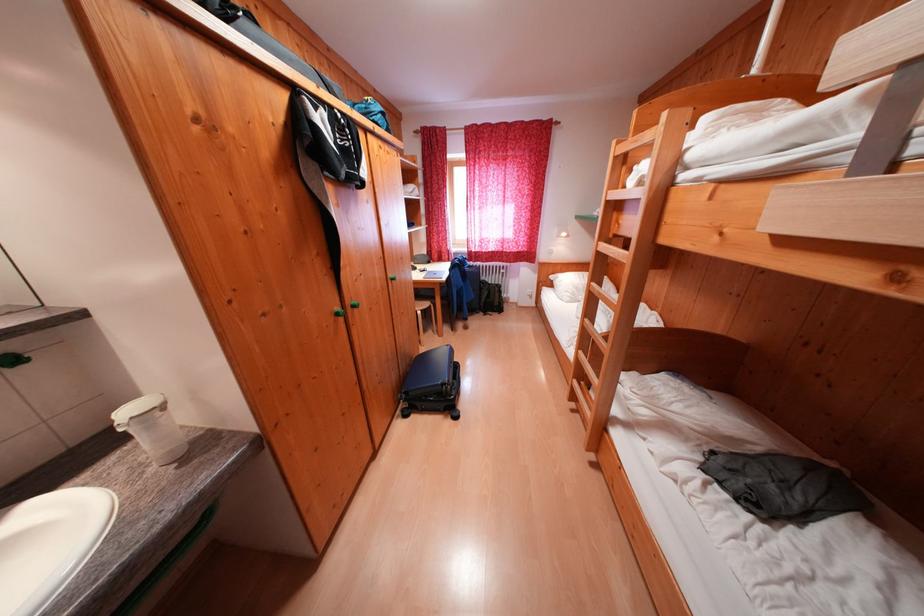
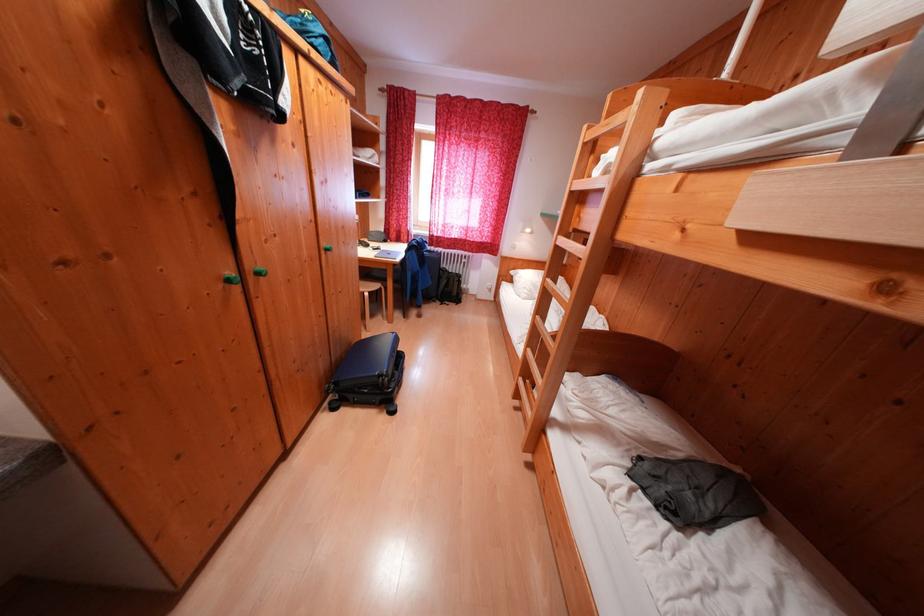
The point at (433, 309) is marked in the first image. Where is the corresponding point in the second image?

(383, 290)